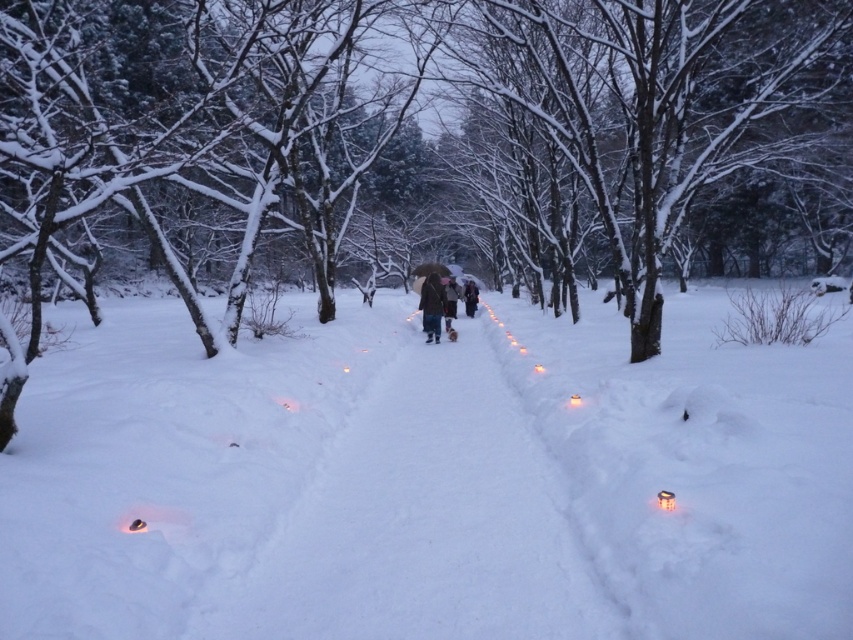
Is dark brown leather jacket at center to the right of dark gray wool coat at center from the viewer's perspective?

Incorrect, dark brown leather jacket at center is not on the right side of dark gray wool coat at center.

Is dark brown leather jacket at center to the left of dark gray wool coat at center from the viewer's perspective?

Correct, you'll find dark brown leather jacket at center to the left of dark gray wool coat at center.

Is point (448, 314) behind point (467, 300)?

No, (448, 314) is in front of (467, 300).

You are a GUI agent. You are given a task and a screenshot of the screen. Output one action in this format:
    pyautogui.click(x=<x>, y=<y>)
    Task: Click on the dark brown leather jacket at center
    This screenshot has height=640, width=853.
    Given the screenshot: What is the action you would take?
    tap(450, 300)

Is snow-covered tree at center taller than dark gray wool coat at center?

Yes, snow-covered tree at center is taller than dark gray wool coat at center.

Measure the distance between snow-covered tree at center and camera.

A distance of 14.65 feet exists between snow-covered tree at center and camera.

This screenshot has width=853, height=640. I want to click on snow-covered tree at center, so click(451, 132).

Can you confirm if snow-covered tree at center is positioned above brown woolen coat at center?

Correct, snow-covered tree at center is located above brown woolen coat at center.

This screenshot has width=853, height=640. Describe the element at coordinates (451, 132) in the screenshot. I see `snow-covered tree at center` at that location.

You are a GUI agent. You are given a task and a screenshot of the screen. Output one action in this format:
    pyautogui.click(x=<x>, y=<y>)
    Task: Click on the snow-covered tree at center
    
    Given the screenshot: What is the action you would take?
    pyautogui.click(x=451, y=132)